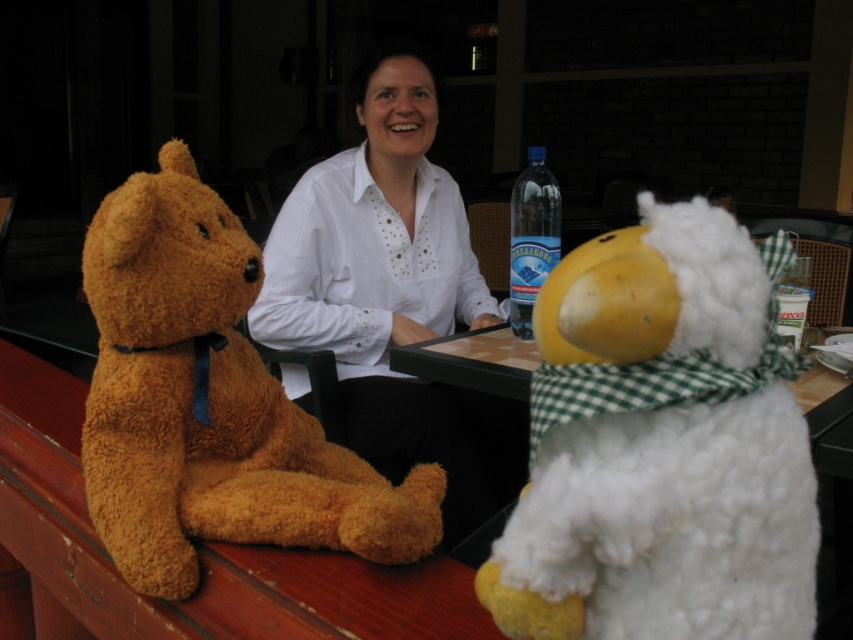
You are a customer in this cozy indoor setting and want to place a small gift box between the white fluffy stuffed animal at right and the fuzzy brown teddy bear at left. Can the gift box fit between them if it requires 10 cm of space?

The white fluffy stuffed animal at right has a lesser width compared to the fuzzy brown teddy bear at left, but the exact distance between them isn